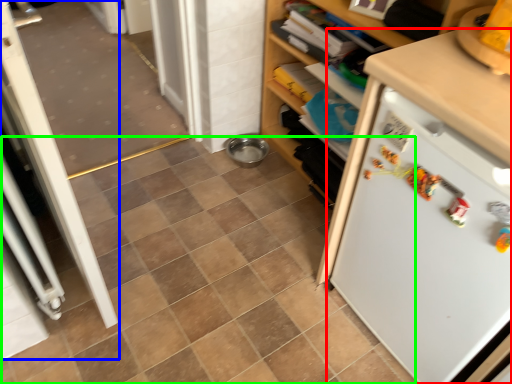
Question: Based on their relative distances, which object is nearer to refrigerator (highlighted by a red box)? Choose from screen door (highlighted by a blue box) and ceramic tile (highlighted by a green box).

Choices:
 (A) screen door
 (B) ceramic tile

Answer: (B)